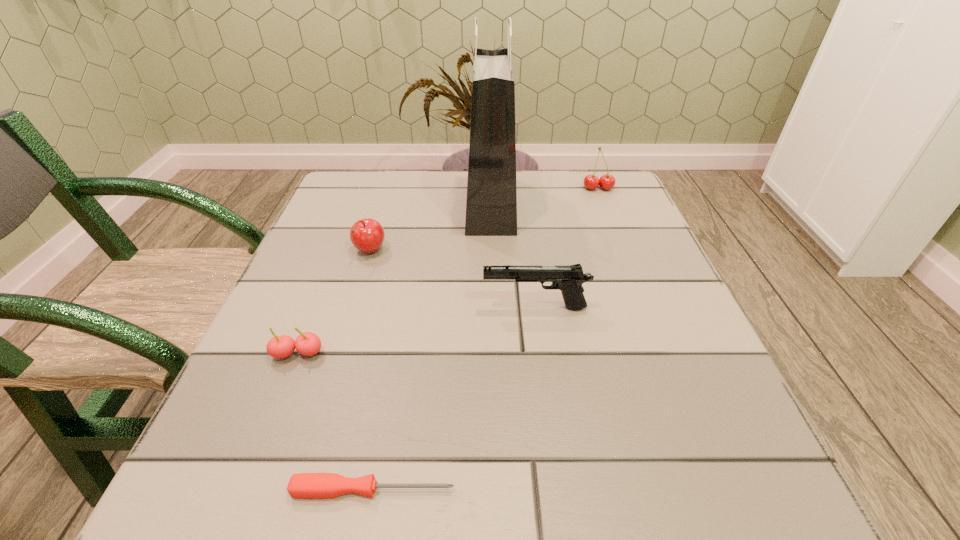
Find the location of a particular element. This screenshot has height=540, width=960. shopping bag is located at coordinates (491, 203).

Identify the location of the tallest cherry. (607, 181).

This screenshot has height=540, width=960. Find the location of `the rightmost object`. the rightmost object is located at coordinates (607, 181).

The width and height of the screenshot is (960, 540). I want to click on gun, so click(x=569, y=279).

The height and width of the screenshot is (540, 960). In order to click on the second farthest cherry in this screenshot , I will do coord(367,235).

Where is `the second shortest cherry`? the second shortest cherry is located at coordinates (367, 235).

At what (x,y) coordinates should I click in order to perform the action: click on the fifth tallest object. Please return your answer as a coordinate pair (x, y). This screenshot has width=960, height=540. Looking at the image, I should click on (307, 343).

Image resolution: width=960 pixels, height=540 pixels. In order to click on the nearest cherry in this screenshot , I will do `click(307, 343)`.

At what (x,y) coordinates should I click in order to perform the action: click on screwdriver. Please return your answer as a coordinate pair (x, y). Looking at the image, I should click on (301, 485).

The width and height of the screenshot is (960, 540). In order to click on the shortest object in this screenshot , I will do `click(301, 485)`.